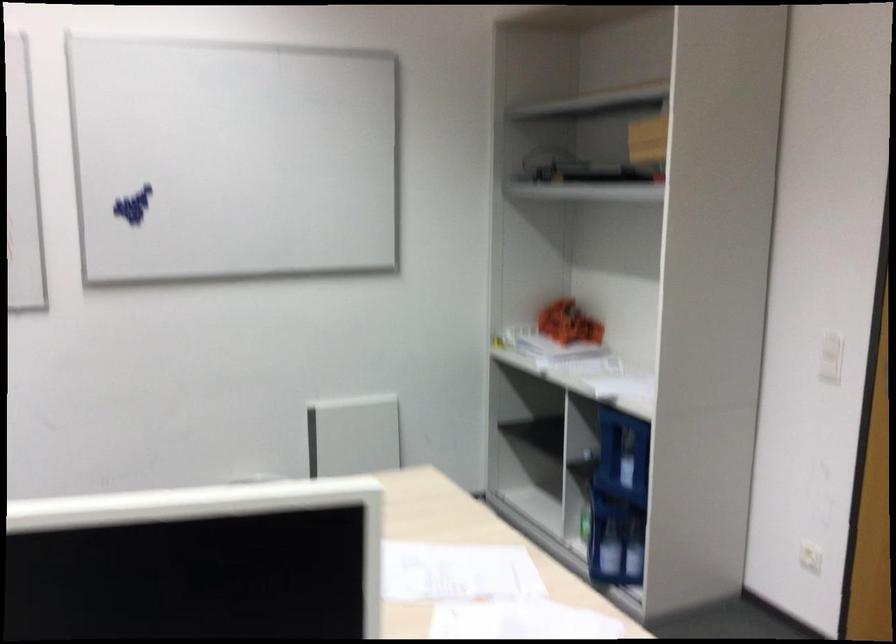
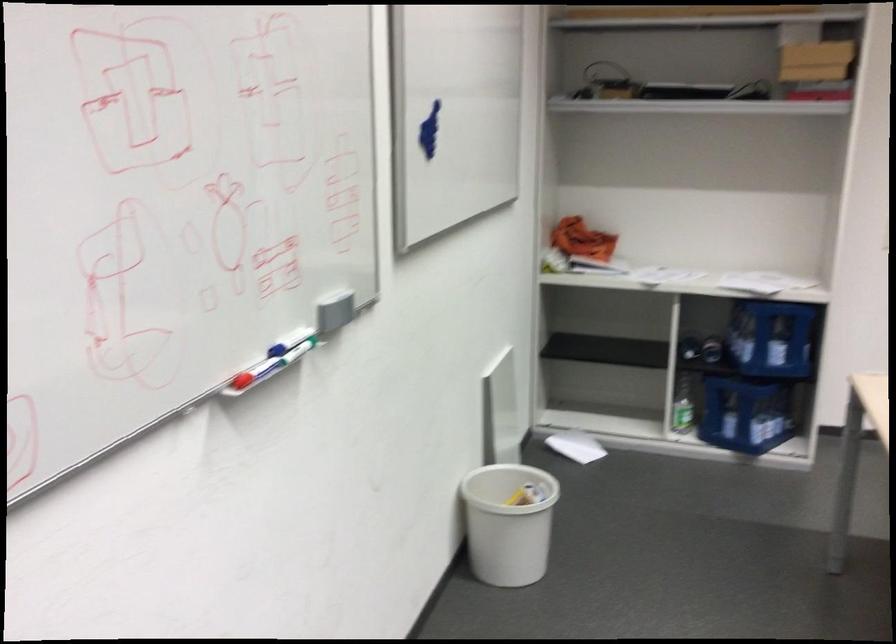
Where in the second image is the point corresponding to (633,352) from the first image?

(660, 275)